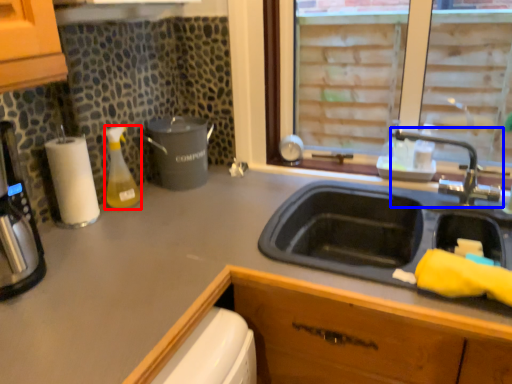
Question: Which of the following is the closest to the observer, bottle (highlighted by a red box) or tap (highlighted by a blue box)?

Choices:
 (A) bottle
 (B) tap

Answer: (B)